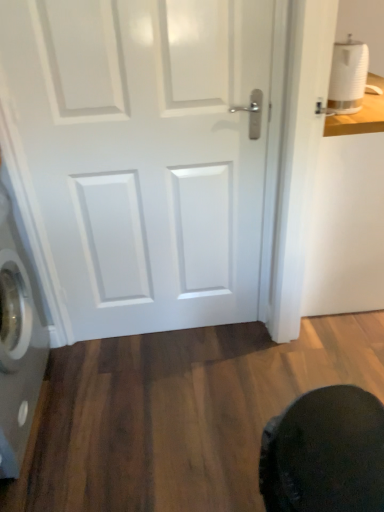
The image size is (384, 512). In order to click on white glossy door at center in this screenshot , I will do `click(140, 157)`.

Where is `silver metallic washing machine at left`? The height and width of the screenshot is (512, 384). silver metallic washing machine at left is located at coordinates (17, 344).

The height and width of the screenshot is (512, 384). Identify the location of white glossy door at center. (140, 157).

Is the depth of silver metallic washing machine at left greater than that of white glossy door at center?

No, silver metallic washing machine at left is closer to the camera.

Is white glossy door at center located within silver metallic washing machine at left?

No.

Is silver metallic washing machine at left far from white glossy door at center?

No.

How different are the orientations of white glossy door at center and silver metallic washing machine at left in degrees?

white glossy door at center and silver metallic washing machine at left are facing 89.4 degrees away from each other.

Locate an element on the screen. door on the right of silver metallic washing machine at left is located at coordinates (140, 157).

Is white glossy door at center placed right next to silver metallic washing machine at left?

No, white glossy door at center is not with silver metallic washing machine at left.

How distant is white glossy door at center from silver metallic washing machine at left?

The distance of white glossy door at center from silver metallic washing machine at left is 17.93 inches.

From a real-world perspective, which object stands above the other?

white matte toilet paper at upper right is physically above.

Which point is more distant from viewer, (336, 75) or (333, 435)?

The point (336, 75) is farther.

Can you confirm if white matte toilet paper at upper right is positioned to the right of dark fabric swivel chair at lower right?

Correct, you'll find white matte toilet paper at upper right to the right of dark fabric swivel chair at lower right.

This screenshot has width=384, height=512. I want to click on swivel chair beneath the white matte toilet paper at upper right (from a real-world perspective), so click(x=325, y=453).

Considering the relative sizes of dark fabric swivel chair at lower right and white glossy door at center in the image provided, is dark fabric swivel chair at lower right shorter than white glossy door at center?

Indeed, dark fabric swivel chair at lower right has a lesser height compared to white glossy door at center.

Would you say white glossy door at center is part of dark fabric swivel chair at lower right's contents?

No, white glossy door at center is not a part of dark fabric swivel chair at lower right.

The image size is (384, 512). Find the location of `door on the left of dark fabric swivel chair at lower right`. door on the left of dark fabric swivel chair at lower right is located at coordinates (x=140, y=157).

From the image's perspective, would you say dark fabric swivel chair at lower right is shown under white glossy door at center?

Yes.

Between silver metallic washing machine at left and white matte toilet paper at upper right, which one is positioned in front?

Positioned in front is silver metallic washing machine at left.

Can you confirm if silver metallic washing machine at left is thinner than white matte toilet paper at upper right?

Incorrect, the width of silver metallic washing machine at left is not less than that of white matte toilet paper at upper right.

Considering the relative positions of silver metallic washing machine at left and white matte toilet paper at upper right in the image provided, is silver metallic washing machine at left to the right of white matte toilet paper at upper right from the viewer's perspective?

No.

Does silver metallic washing machine at left have a greater height compared to white matte toilet paper at upper right?

Indeed, silver metallic washing machine at left has a greater height compared to white matte toilet paper at upper right.

Does white matte toilet paper at upper right have a larger size compared to silver metallic washing machine at left?

Incorrect, white matte toilet paper at upper right is not larger than silver metallic washing machine at left.

Considering the relative sizes of white matte toilet paper at upper right and silver metallic washing machine at left in the image provided, is white matte toilet paper at upper right taller than silver metallic washing machine at left?

No.

Considering the relative sizes of silver metallic washing machine at left and dark fabric swivel chair at lower right in the image provided, is silver metallic washing machine at left wider than dark fabric swivel chair at lower right?

No, silver metallic washing machine at left is not wider than dark fabric swivel chair at lower right.

Is silver metallic washing machine at left outside of dark fabric swivel chair at lower right?

silver metallic washing machine at left lies outside dark fabric swivel chair at lower right's area.

Is silver metallic washing machine at left looking in the opposite direction of dark fabric swivel chair at lower right?

silver metallic washing machine at left does not have its back to dark fabric swivel chair at lower right.

Can you confirm if silver metallic washing machine at left is positioned to the left of dark fabric swivel chair at lower right?

Indeed, silver metallic washing machine at left is positioned on the left side of dark fabric swivel chair at lower right.

This screenshot has height=512, width=384. Identify the location of washing machine below the white glossy door at center (from a real-world perspective). (17, 344).

Where is `door above the silver metallic washing machine at left (from the image's perspective)`? The image size is (384, 512). door above the silver metallic washing machine at left (from the image's perspective) is located at coordinates (140, 157).

Based on the photo, from the image, which object appears to be nearer to white glossy door at center, dark fabric swivel chair at lower right or silver metallic washing machine at left?

The object closer to white glossy door at center is silver metallic washing machine at left.

When comparing their distances from white matte toilet paper at upper right, does dark fabric swivel chair at lower right or silver metallic washing machine at left seem further?

silver metallic washing machine at left is further to white matte toilet paper at upper right.

Looking at the image, which one is located further to silver metallic washing machine at left, white glossy door at center or white matte toilet paper at upper right?

Among the two, white matte toilet paper at upper right is located further to silver metallic washing machine at left.

When comparing their distances from silver metallic washing machine at left, does dark fabric swivel chair at lower right or white matte toilet paper at upper right seem closer?

Among the two, dark fabric swivel chair at lower right is located nearer to silver metallic washing machine at left.

From the picture: Looking at the image, which one is located further to dark fabric swivel chair at lower right, white glossy door at center or white matte toilet paper at upper right?

The object further to dark fabric swivel chair at lower right is white matte toilet paper at upper right.

From the image, which object appears to be farther from silver metallic washing machine at left, white matte toilet paper at upper right or dark fabric swivel chair at lower right?

The object further to silver metallic washing machine at left is white matte toilet paper at upper right.

Considering their positions, is white matte toilet paper at upper right positioned closer to white glossy door at center than dark fabric swivel chair at lower right?

white matte toilet paper at upper right is closer to white glossy door at center.

Consider the image. Estimate the real-world distances between objects in this image. Which object is further from dark fabric swivel chair at lower right, white matte toilet paper at upper right or white glossy door at center?

white matte toilet paper at upper right.

In order to click on swivel chair between silver metallic washing machine at left and white matte toilet paper at upper right from left to right in this screenshot , I will do `click(325, 453)`.

Locate an element on the screen. The height and width of the screenshot is (512, 384). door between white matte toilet paper at upper right and dark fabric swivel chair at lower right vertically is located at coordinates (140, 157).

Locate an element on the screen. The image size is (384, 512). door between silver metallic washing machine at left and white matte toilet paper at upper right is located at coordinates (140, 157).

You are a GUI agent. You are given a task and a screenshot of the screen. Output one action in this format:
    pyautogui.click(x=<x>, y=<y>)
    Task: Click on the door situated between silver metallic washing machine at left and dark fabric swivel chair at lower right from left to right
    Image resolution: width=384 pixels, height=512 pixels.
    Given the screenshot: What is the action you would take?
    pyautogui.click(x=140, y=157)